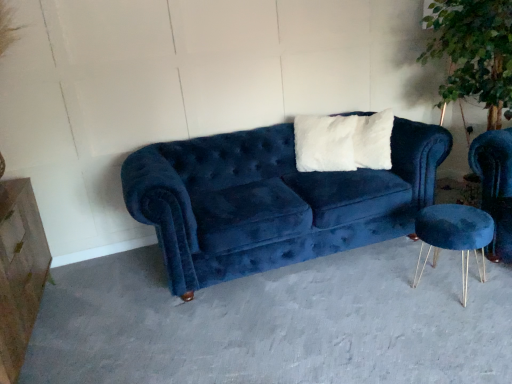
Find the location of a particular element. free space above velvet blue stool at lower right (from a real-world perspective) is located at coordinates (454, 213).